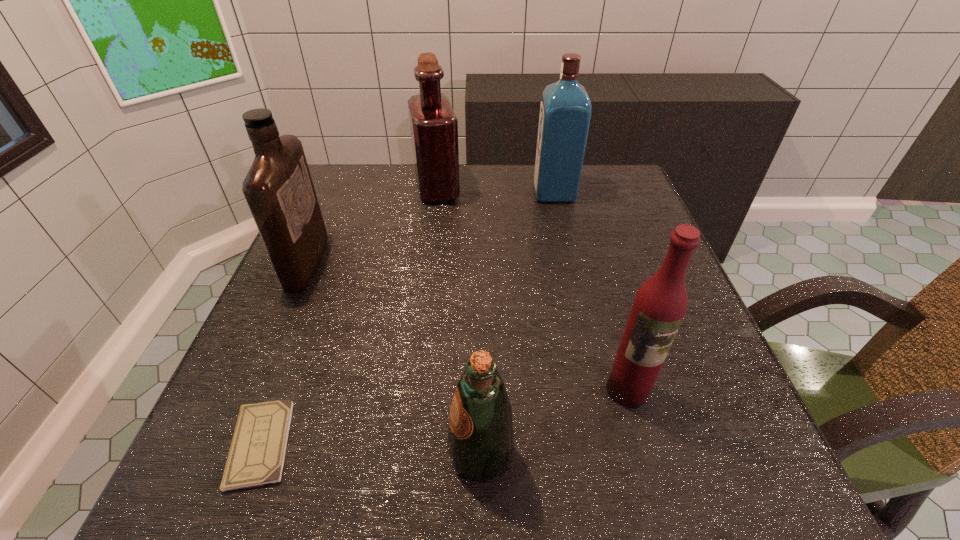
In the image, there is a desktop. Where is `vacant space at the right edge`? This screenshot has height=540, width=960. vacant space at the right edge is located at coordinates (636, 232).

At what (x,y) coordinates should I click in order to perform the action: click on free region at the far left corner of the desktop. Please return your answer as a coordinate pair (x, y). Looking at the image, I should click on (340, 202).

This screenshot has width=960, height=540. In the image, there is a desktop. Identify the location of free space at the far right corner. (624, 165).

In the image, there is a desktop. Where is `vacant space at the near right corner`? vacant space at the near right corner is located at coordinates (696, 499).

I want to click on blank region between the second shortest object and the nearest liquor, so click(x=554, y=422).

You are a GUI agent. You are given a task and a screenshot of the screen. Output one action in this format:
    pyautogui.click(x=<x>, y=<y>)
    Task: Click on the unoccupied area between the shortest object and the second nearest liquor
    The image size is (960, 540).
    Given the screenshot: What is the action you would take?
    pyautogui.click(x=284, y=352)

Image resolution: width=960 pixels, height=540 pixels. In order to click on unoccupied position between the olive oil and the nearest liquor in this screenshot , I will do `click(554, 422)`.

The image size is (960, 540). What are the coordinates of `free point between the leftmost liquor and the third liquor from right to left` in the screenshot? It's located at (372, 225).

Locate an element on the screen. free space that is in between the fourth nearest object and the third object from left to right is located at coordinates (372, 225).

Where is `vacant area that lies between the second liquor from left to right and the second shortest object`? The image size is (960, 540). vacant area that lies between the second liquor from left to right and the second shortest object is located at coordinates (459, 321).